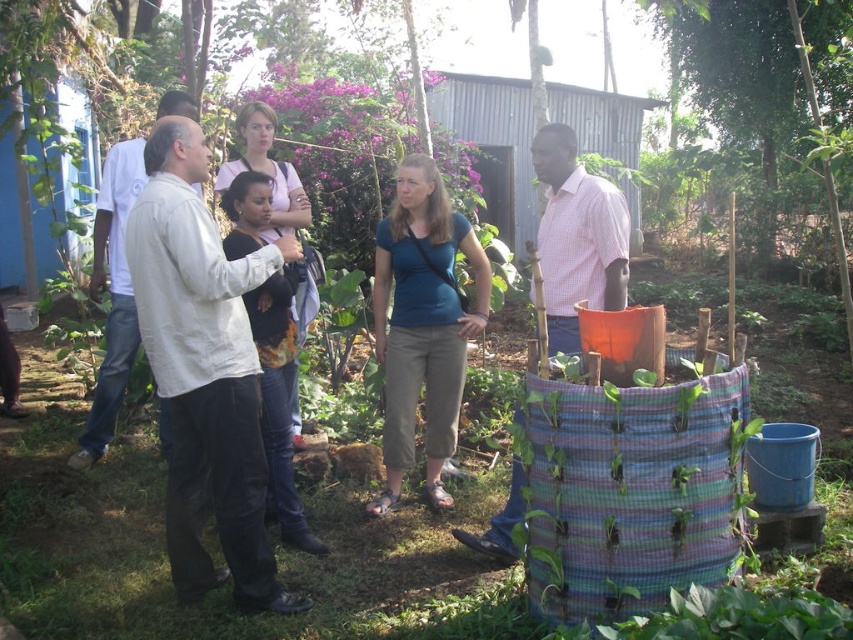
Measure the distance between white cotton shirt at center and green leafy tree at upper right.

They are 39.74 feet apart.

Can you confirm if white cotton shirt at center is wider than green leafy tree at upper right?

No, white cotton shirt at center is not wider than green leafy tree at upper right.

Does point (167, 456) come in front of point (769, 72)?

That is True.

Locate an element on the screen. white cotton shirt at center is located at coordinates (202, 371).

Between white cotton shirt at center and blue cotton shirt at center, which one appears on the right side from the viewer's perspective?

blue cotton shirt at center is more to the right.

Is white cotton shirt at center smaller than blue cotton shirt at center?

Actually, white cotton shirt at center might be larger than blue cotton shirt at center.

Between point (190, 368) and point (387, 236), which one is positioned behind?

The point (387, 236) is more distant.

Where is `white cotton shirt at center`? The width and height of the screenshot is (853, 640). white cotton shirt at center is located at coordinates (202, 371).

Who is shorter, blue cotton shirt at center or green leafy tree at upper right?

With less height is green leafy tree at upper right.

Is blue cotton shirt at center to the right of green leafy tree at upper right from the viewer's perspective?

Incorrect, blue cotton shirt at center is not on the right side of green leafy tree at upper right.

This screenshot has height=640, width=853. In order to click on blue cotton shirt at center in this screenshot , I will do `click(422, 323)`.